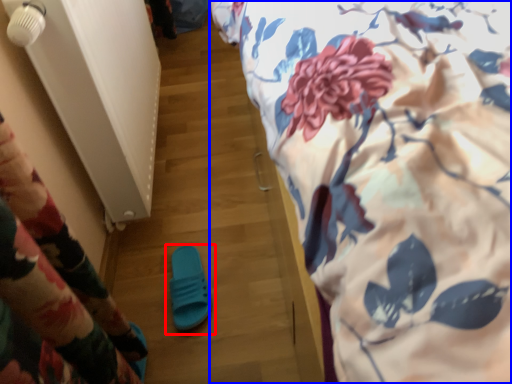
Question: Among these objects, which one is farthest to the camera, footwear (highlighted by a red box) or bed (highlighted by a blue box)?

Choices:
 (A) footwear
 (B) bed

Answer: (A)